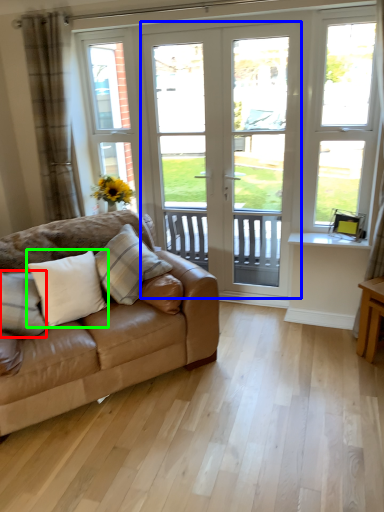
Question: Based on their relative distances, which object is farther from pillow (highlighted by a red box)? Choose from door (highlighted by a blue box) and pillow (highlighted by a green box).

Choices:
 (A) door
 (B) pillow

Answer: (A)